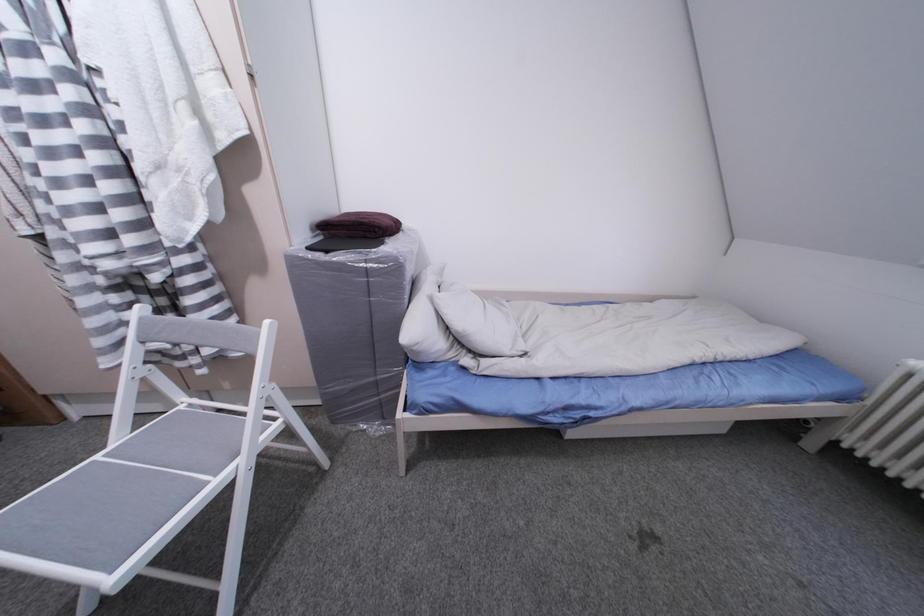
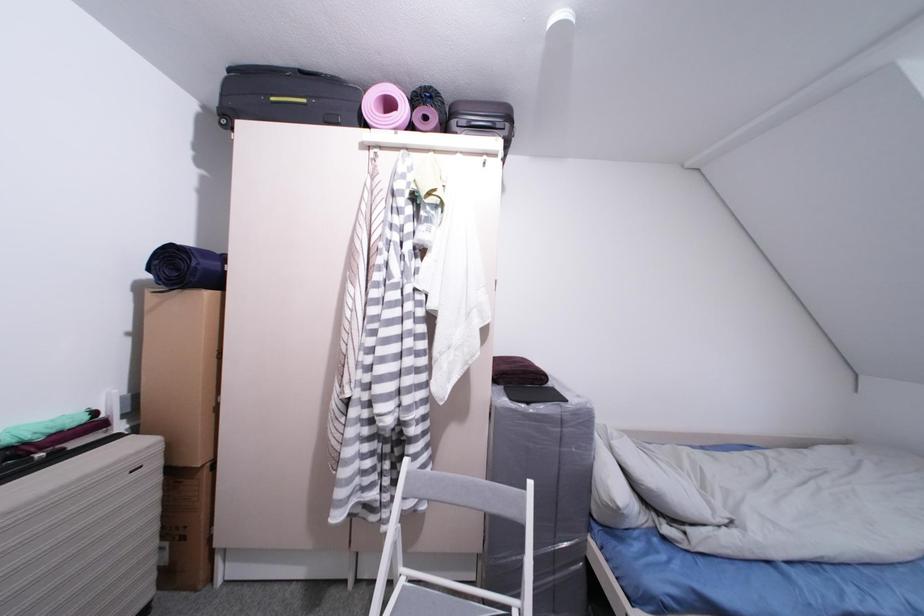
Question: What movement of the cameraman would produce the second image?

Choices:
 (A) Left
 (B) Right
 (C) Forward
 (D) Backward

Answer: (A)